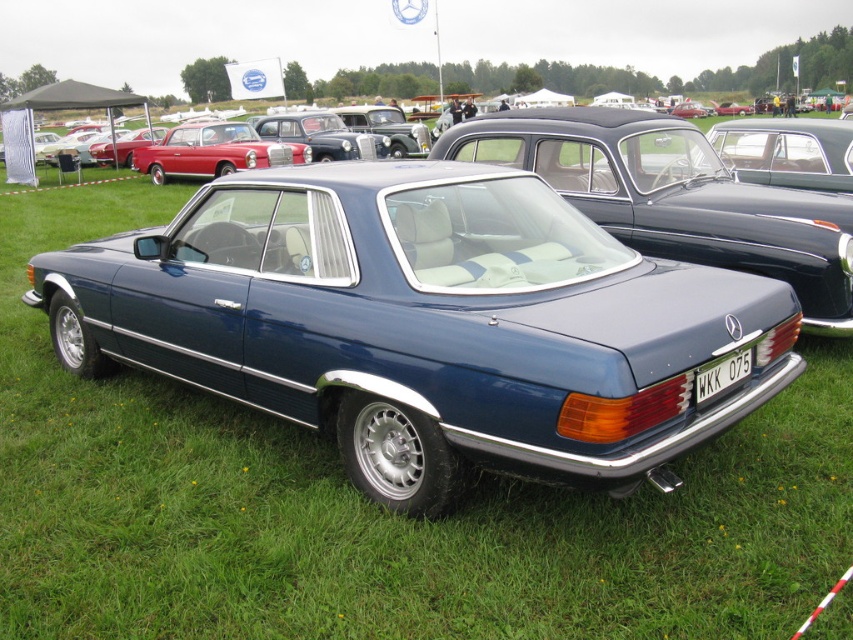
You are a photographer trying to capture the shiny red car at upper left and the white plastic license plate at center in a single shot. Since you want the license plate to be clearly visible, would the height difference between them be an issue?

The shiny red car at upper left is taller than the white plastic license plate at center, so the height difference might make it harder to focus on both in one shot. Adjust your angle or zoom to ensure both are visible and in focus.

You are a photographer at the car show and need to capture both the satin blue car at center and the shiny red car at upper left in a single wide shot. Which car should you position closer to the camera to ensure both are visible without cropping?

To ensure both the satin blue car at center and the shiny red car at upper left are visible without cropping in a single wide shot, position the smaller shiny red car at upper left closer to the camera. Since the satin blue car at center is bigger, it will naturally appear larger even if placed farther back, allowing both to fit within the frame.